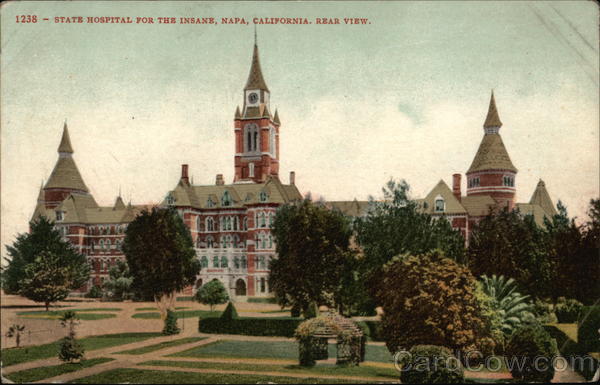
The height and width of the screenshot is (385, 600). What are the coordinates of `chimney` in the screenshot? It's located at (182, 167), (291, 175), (221, 181), (458, 181).